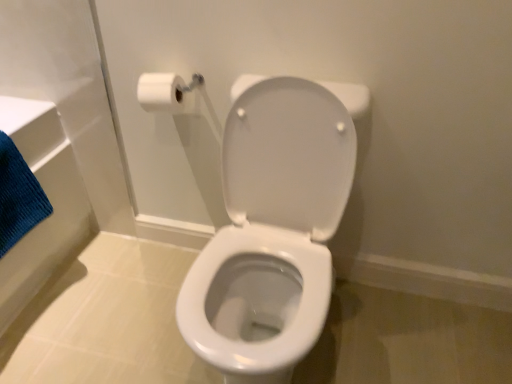
I want to click on free space to the left of white glossy toilet at center, so click(x=117, y=312).